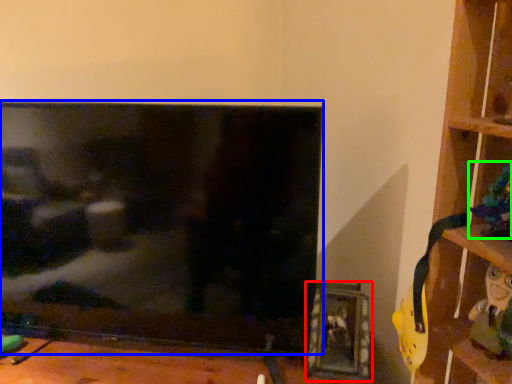
Question: Which is farther away from picture frame (highlighted by a red box)? television (highlighted by a blue box) or toy (highlighted by a green box)?

Choices:
 (A) television
 (B) toy

Answer: (B)